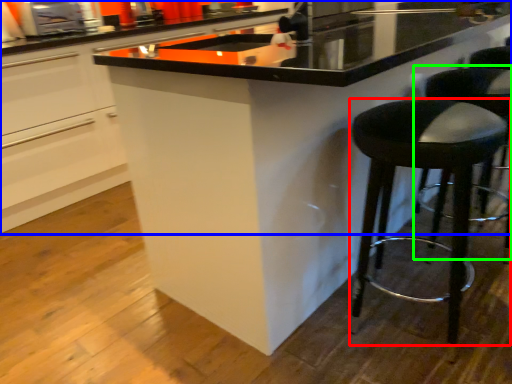
Question: Considering the real-world distances, which object is closest to stool (highlighted by a red box)? cabinetry (highlighted by a blue box) or bar stool (highlighted by a green box).

Choices:
 (A) cabinetry
 (B) bar stool

Answer: (B)